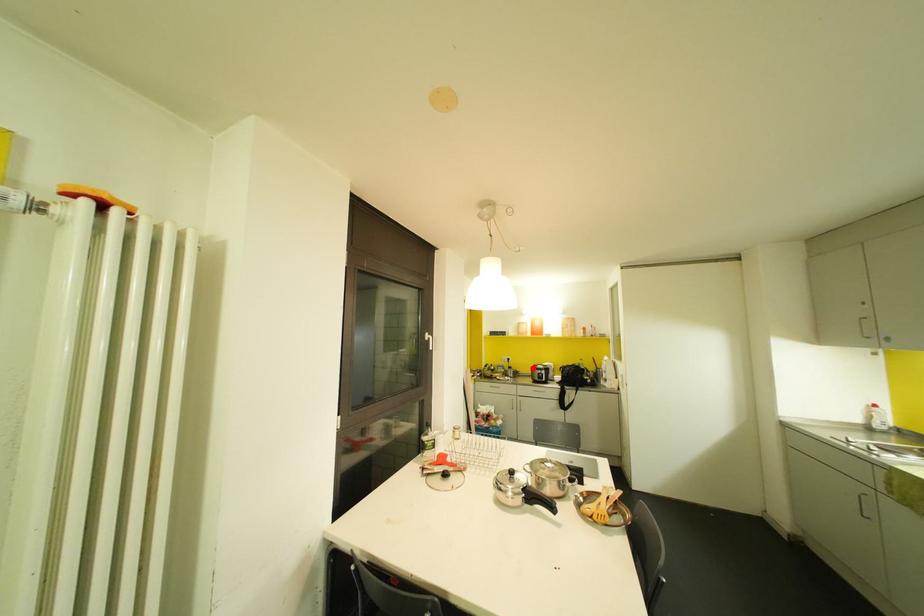
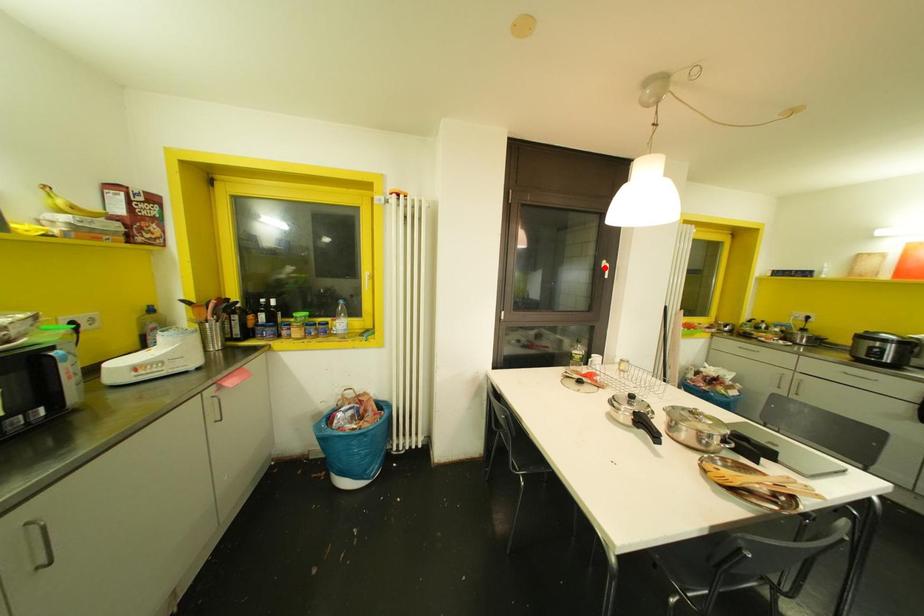
I am providing you with two images of the same scene from different viewpoints. A red point is marked on the first image and another point is marked on the second image. Are the points marked in image1 and image2 representing the same 3D position?

No